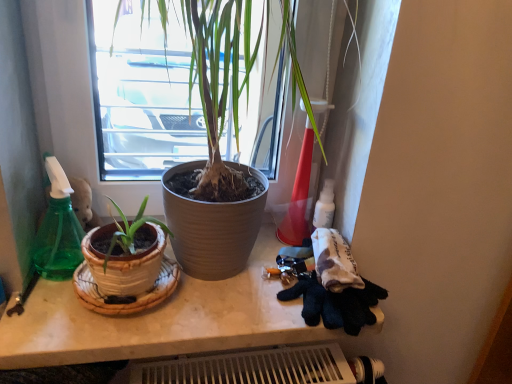
The width and height of the screenshot is (512, 384). What are the coordinates of `vacant region in front of green plastic spray bottle at left` in the screenshot? It's located at (42, 314).